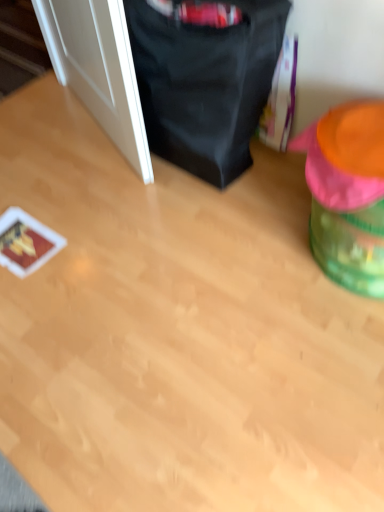
Question: Is green plastic bean bag chair at right, which is counted as the first bean bag chair, starting from the right, completely or partially outside of white glossy door at left?

Choices:
 (A) yes
 (B) no

Answer: (A)

Question: Considering the relative sizes of green plastic bean bag chair at right, the 2th bean bag chair viewed from the left, and white glossy door at left in the image provided, is green plastic bean bag chair at right, the 2th bean bag chair viewed from the left, wider than white glossy door at left?

Choices:
 (A) yes
 (B) no

Answer: (A)

Question: Does green plastic bean bag chair at right, the 2th bean bag chair viewed from the left, turn towards white glossy door at left?

Choices:
 (A) no
 (B) yes

Answer: (A)

Question: From the image's perspective, is green plastic bean bag chair at right, which is counted as the first bean bag chair, starting from the right, located beneath white glossy door at left?

Choices:
 (A) yes
 (B) no

Answer: (A)

Question: Considering the relative sizes of green plastic bean bag chair at right, which is counted as the first bean bag chair, starting from the right, and white glossy door at left in the image provided, is green plastic bean bag chair at right, which is counted as the first bean bag chair, starting from the right, taller than white glossy door at left?

Choices:
 (A) no
 (B) yes

Answer: (A)

Question: From their relative heights in the image, would you say green plastic bean bag chair at right, which is counted as the first bean bag chair, starting from the right, is taller or shorter than black fabric bean bag chair at upper center, placed as the 1th bean bag chair when sorted from left to right?

Choices:
 (A) tall
 (B) short

Answer: (B)

Question: Is green plastic bean bag chair at right, the 2th bean bag chair viewed from the left, wider or thinner than black fabric bean bag chair at upper center, the second bean bag chair from the right?

Choices:
 (A) thin
 (B) wide

Answer: (B)

Question: Based on their sizes in the image, would you say green plastic bean bag chair at right, the 2th bean bag chair viewed from the left, is bigger or smaller than black fabric bean bag chair at upper center, placed as the 1th bean bag chair when sorted from left to right?

Choices:
 (A) small
 (B) big

Answer: (A)

Question: Considering the positions of point (362, 257) and point (223, 35), is point (362, 257) closer or farther from the camera than point (223, 35)?

Choices:
 (A) closer
 (B) farther

Answer: (A)

Question: Is white glossy door at left wider or thinner than green plastic bean bag chair at right, which is counted as the first bean bag chair, starting from the right?

Choices:
 (A) wide
 (B) thin

Answer: (B)

Question: From a real-world perspective, is white glossy door at left positioned above or below green plastic bean bag chair at right, which is counted as the first bean bag chair, starting from the right?

Choices:
 (A) below
 (B) above

Answer: (B)

Question: From the image's perspective, is white glossy door at left located above or below green plastic bean bag chair at right, the 2th bean bag chair viewed from the left?

Choices:
 (A) below
 (B) above

Answer: (B)

Question: Relative to green plastic bean bag chair at right, which is counted as the first bean bag chair, starting from the right, is white glossy door at left in front or behind?

Choices:
 (A) behind
 (B) front

Answer: (A)

Question: Visually, is white glossy door at left positioned to the left or to the right of black fabric bean bag chair at upper center, placed as the 1th bean bag chair when sorted from left to right?

Choices:
 (A) right
 (B) left

Answer: (B)

Question: From the image's perspective, is white glossy door at left above or below black fabric bean bag chair at upper center, the second bean bag chair from the right?

Choices:
 (A) below
 (B) above

Answer: (B)